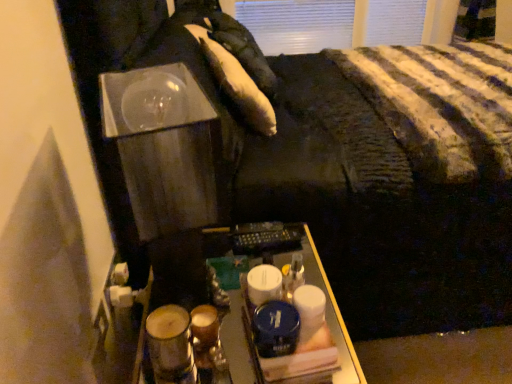
Question: From a real-world perspective, does white soft pillow at upper center, the second pillow in the front-to-back sequence, sit lower than white soft pillow at upper center, which is counted as the first pillow, starting from the bottom?

Choices:
 (A) yes
 (B) no

Answer: (B)

Question: From the image's perspective, does white soft pillow at upper center, acting as the 2th pillow starting from the bottom, appear lower than white soft pillow at upper center, which is counted as the first pillow, starting from the bottom?

Choices:
 (A) no
 (B) yes

Answer: (A)

Question: Considering the relative sizes of white soft pillow at upper center, the second pillow in the front-to-back sequence, and white soft pillow at upper center, which is counted as the first pillow, starting from the bottom, in the image provided, is white soft pillow at upper center, the second pillow in the front-to-back sequence, smaller than white soft pillow at upper center, which is counted as the first pillow, starting from the bottom,?

Choices:
 (A) no
 (B) yes

Answer: (A)

Question: Is the position of white soft pillow at upper center, acting as the 2th pillow starting from the bottom, more distant than that of white soft pillow at upper center, arranged as the 2th pillow when viewed from the back?

Choices:
 (A) no
 (B) yes

Answer: (B)

Question: Is white soft pillow at upper center, the 1th pillow from the top, far from white soft pillow at upper center, which is the second pillow in top-to-bottom order?

Choices:
 (A) yes
 (B) no

Answer: (B)

Question: Is white soft pillow at upper center, acting as the 2th pillow starting from the bottom, closer to camera compared to white soft pillow at upper center, which is counted as the first pillow, starting from the bottom?

Choices:
 (A) no
 (B) yes

Answer: (A)

Question: Does metallic remote control at center appear on the left side of white soft pillow at upper center, which ranks as the 1th pillow in front-to-back order?

Choices:
 (A) no
 (B) yes

Answer: (B)

Question: Does metallic remote control at center have a lesser height compared to white soft pillow at upper center, which is the second pillow in top-to-bottom order?

Choices:
 (A) yes
 (B) no

Answer: (B)

Question: Can white soft pillow at upper center, which is the second pillow in top-to-bottom order, be found inside metallic remote control at center?

Choices:
 (A) no
 (B) yes

Answer: (A)

Question: Is metallic remote control at center completely or partially outside of white soft pillow at upper center, which is counted as the first pillow, starting from the bottom?

Choices:
 (A) yes
 (B) no

Answer: (A)

Question: Is metallic remote control at center far away from white soft pillow at upper center, arranged as the 2th pillow when viewed from the back?

Choices:
 (A) yes
 (B) no

Answer: (B)

Question: From the image's perspective, does metallic remote control at center appear lower than white soft pillow at upper center, which is counted as the first pillow, starting from the bottom?

Choices:
 (A) no
 (B) yes

Answer: (B)

Question: From a real-world perspective, is metallic remote control at center positioned under matte brown glass at lower left based on gravity?

Choices:
 (A) no
 (B) yes

Answer: (B)